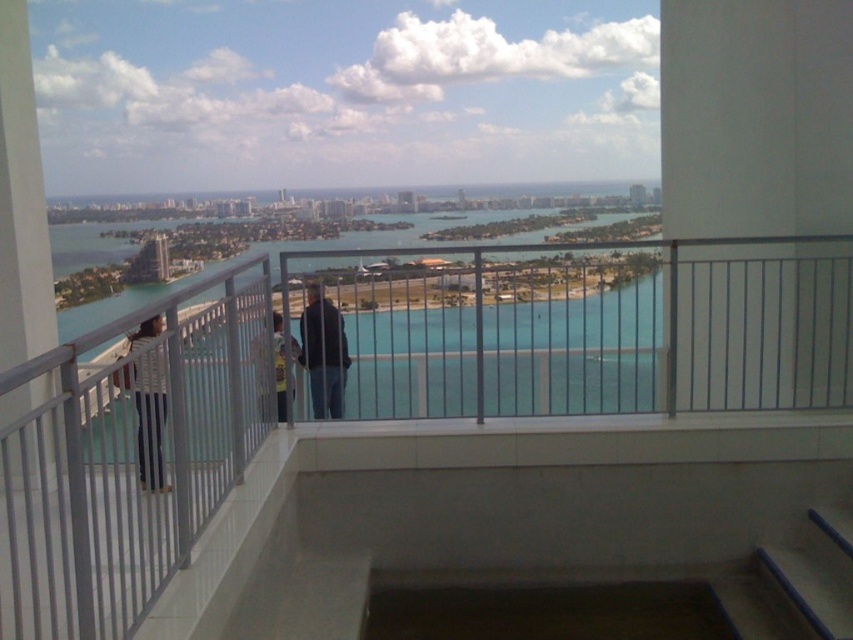
Is dark blue jeans at center below yellow t-shirt at center?

Correct, dark blue jeans at center is located below yellow t-shirt at center.

From the picture: Who is more distant from viewer, (306, 296) or (283, 353)?

Point (306, 296)

This screenshot has height=640, width=853. I want to click on dark blue jeans at center, so click(x=322, y=353).

Can you confirm if white metal railing at upper center is positioned to the right of dark blue jeans at center?

Incorrect, white metal railing at upper center is not on the right side of dark blue jeans at center.

Between point (807, 321) and point (306, 346), which one is positioned behind?

The point (306, 346) is more distant.

The width and height of the screenshot is (853, 640). Find the location of `white metal railing at upper center`. white metal railing at upper center is located at coordinates (390, 385).

Does white fabric at left appear on the left side of dark blue jeans at center?

Indeed, white fabric at left is positioned on the left side of dark blue jeans at center.

Find the location of a particular element. This screenshot has width=853, height=640. white fabric at left is located at coordinates (148, 412).

Where is `white fabric at left`? white fabric at left is located at coordinates (148, 412).